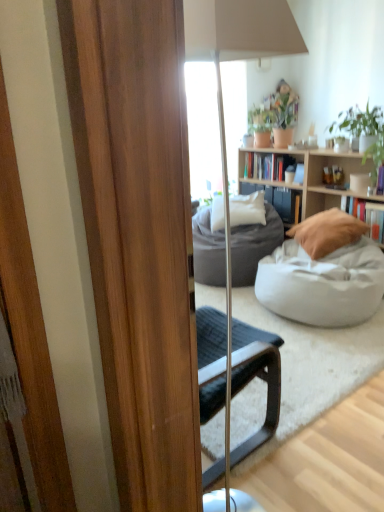
Question: Is white soft pillow at center, the 2th pillow when ordered from right to left, surrounding white fabric bean bag at center, the 2th studio couch in the back-to-front sequence?

Choices:
 (A) no
 (B) yes

Answer: (A)

Question: From a real-world perspective, does white soft pillow at center, the 1th pillow in the left-to-right sequence, sit lower than white fabric bean bag at center, the 2th studio couch in the back-to-front sequence?

Choices:
 (A) no
 (B) yes

Answer: (A)

Question: Is the position of white soft pillow at center, the 2th pillow when ordered from right to left, more distant than that of white fabric bean bag at center, the first studio couch viewed from the front?

Choices:
 (A) yes
 (B) no

Answer: (A)

Question: Is white soft pillow at center, positioned as the 2th pillow in front-to-back order, smaller than white fabric bean bag at center, the first studio couch viewed from the front?

Choices:
 (A) no
 (B) yes

Answer: (B)

Question: From a real-world perspective, is white soft pillow at center, the 1th pillow in the left-to-right sequence, located higher than white fabric bean bag at center, the 2th studio couch in the back-to-front sequence?

Choices:
 (A) no
 (B) yes

Answer: (B)

Question: Is the depth of white soft pillow at center, positioned as the 2th pillow in front-to-back order, less than that of white fabric bean bag at center, the 2th studio couch in the back-to-front sequence?

Choices:
 (A) yes
 (B) no

Answer: (B)

Question: Is hardcover book at right, which is the first book from front to back, aimed at white fabric bean bag at center, the 2th studio couch in the back-to-front sequence?

Choices:
 (A) no
 (B) yes

Answer: (B)

Question: Can you confirm if hardcover book at right, positioned as the 2th book in left-to-right order, is wider than white fabric bean bag at center, the first studio couch viewed from the front?

Choices:
 (A) yes
 (B) no

Answer: (B)

Question: Are hardcover book at right, positioned as the first book in bottom-to-top order, and white fabric bean bag at center, the 2th studio couch in the back-to-front sequence, making contact?

Choices:
 (A) yes
 (B) no

Answer: (B)

Question: Considering the relative sizes of hardcover book at right, which is the first book from front to back, and white fabric bean bag at center, the 2th studio couch in the back-to-front sequence, in the image provided, is hardcover book at right, which is the first book from front to back, shorter than white fabric bean bag at center, the 2th studio couch in the back-to-front sequence,?

Choices:
 (A) yes
 (B) no

Answer: (A)

Question: From a real-world perspective, is hardcover book at right, the first book in the right-to-left sequence, located beneath white fabric bean bag at center, the first studio couch viewed from the front?

Choices:
 (A) no
 (B) yes

Answer: (A)

Question: Considering the relative sizes of hardcover book at right, positioned as the 2th book in left-to-right order, and white fabric bean bag at center, the first studio couch viewed from the front, in the image provided, is hardcover book at right, positioned as the 2th book in left-to-right order, bigger than white fabric bean bag at center, the first studio couch viewed from the front,?

Choices:
 (A) yes
 (B) no

Answer: (B)

Question: Is beige fabric pillow at center-right, the 2th pillow viewed from the left, positioned far away from dark gray fabric studio couch at center, which is the second studio couch from front to back?

Choices:
 (A) no
 (B) yes

Answer: (A)